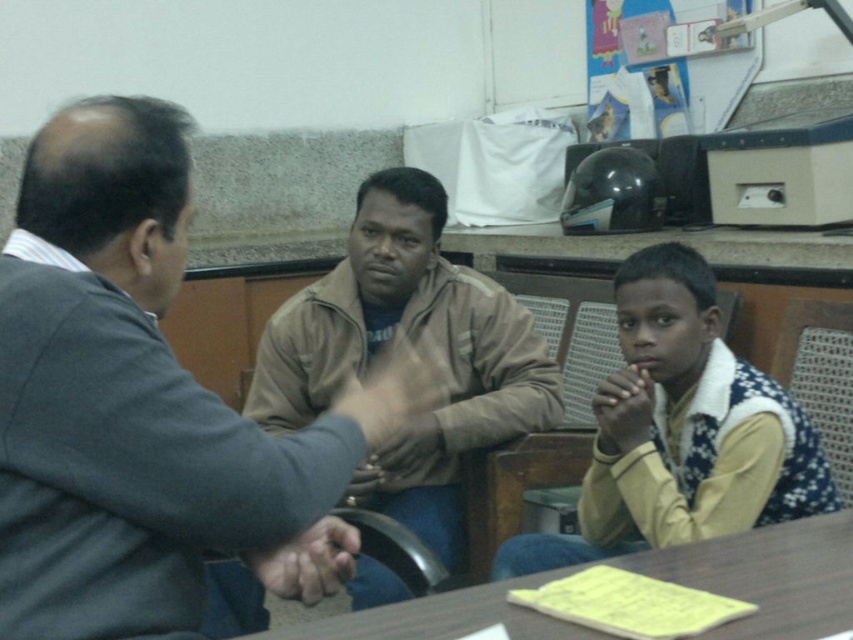
In the scene described, there are two items of clothing visible. The dark gray suit at center and the yellow fleece vest at lower right. Which of these is positioned to the left of the other?

The dark gray suit at center is to the left of the yellow fleece vest at lower right.

You are organizing a small event and need to seat guests around the brown wooden table at lower center. The brown leather jacket at center belongs to a guest who requires a chair that is wider than their jacket. Can you confirm if the chairs available at the table are wide enough for this guest?

The brown leather jacket at center has a width less than the brown wooden table at lower center. Since the table is wider than the jacket, the chairs around the table are likely wide enough to accommodate the guest wearing the brown leather jacket at center.

You are a tailor who needs to determine which garment requires more fabric to make between the dark gray suit at center and the yellow fleece vest at lower right. Which one would need more fabric?

The dark gray suit at center is larger in size than the yellow fleece vest at lower right, so it would require more fabric to make.